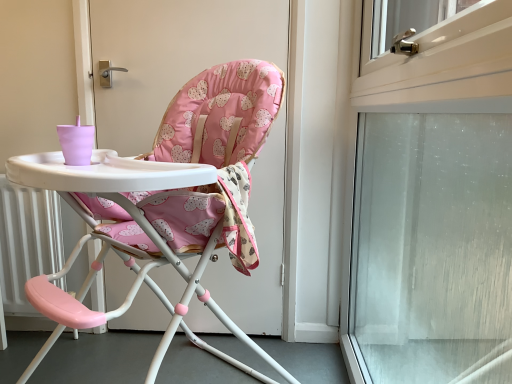
Question: Is frosted glass screen door at right taller or shorter than pink fabric highchair at center?

Choices:
 (A) short
 (B) tall

Answer: (B)

Question: In terms of width, does frosted glass screen door at right look wider or thinner when compared to pink fabric highchair at center?

Choices:
 (A) wide
 (B) thin

Answer: (B)

Question: Considering their positions, is frosted glass screen door at right located in front of or behind pink fabric highchair at center?

Choices:
 (A) front
 (B) behind

Answer: (A)

Question: From the image's perspective, relative to frosted glass screen door at right, is pink fabric highchair at center above or below?

Choices:
 (A) below
 (B) above

Answer: (A)

Question: From a real-world perspective, is pink fabric highchair at center positioned above or below frosted glass screen door at right?

Choices:
 (A) above
 (B) below

Answer: (B)

Question: Is pink fabric highchair at center in front of or behind frosted glass screen door at right in the image?

Choices:
 (A) behind
 (B) front

Answer: (A)

Question: Would you say pink fabric highchair at center is to the left or to the right of frosted glass screen door at right in the picture?

Choices:
 (A) left
 (B) right

Answer: (A)